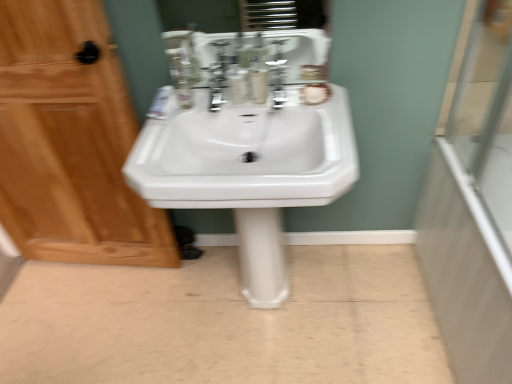
Question: Considering their positions, is transparent glass shower door at right located in front of or behind satin nickel faucet at upper center?

Choices:
 (A) front
 (B) behind

Answer: (A)

Question: From a real-world perspective, relative to satin nickel faucet at upper center, is transparent glass shower door at right vertically above or below?

Choices:
 (A) above
 (B) below

Answer: (B)

Question: Which object is positioned closest to the white glossy pedestal sink at center?

Choices:
 (A) translucent plastic mouthwash at center, marked as the 2th mouthwash in a left-to-right arrangement
 (B) wooden cabinet at left
 (C) white glossy sink at center
 (D) transparent glass shower door at right
 (E) translucent plastic mouthwash at center, positioned as the first mouthwash in left-to-right order

Answer: (B)

Question: Estimate the real-world distances between objects in this image. Which object is closer to the translucent plastic mouthwash at center, marked as the 2th mouthwash in a right-to-left arrangement?

Choices:
 (A) translucent plastic mouthwash at center, which is the 1th mouthwash from right to left
 (B) white glossy sink at center
 (C) wooden cabinet at left
 (D) transparent glass shower door at right
 (E) satin nickel faucet at upper center

Answer: (A)